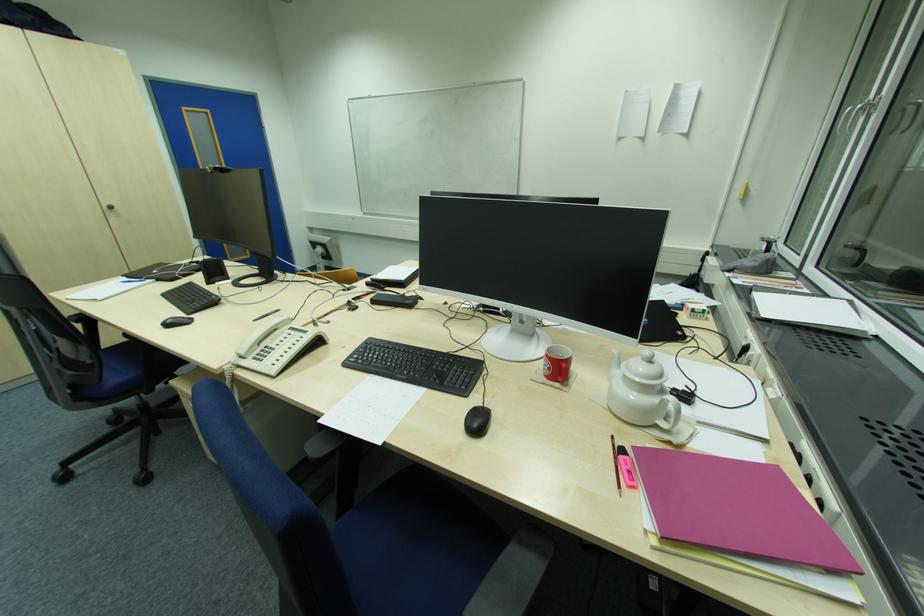
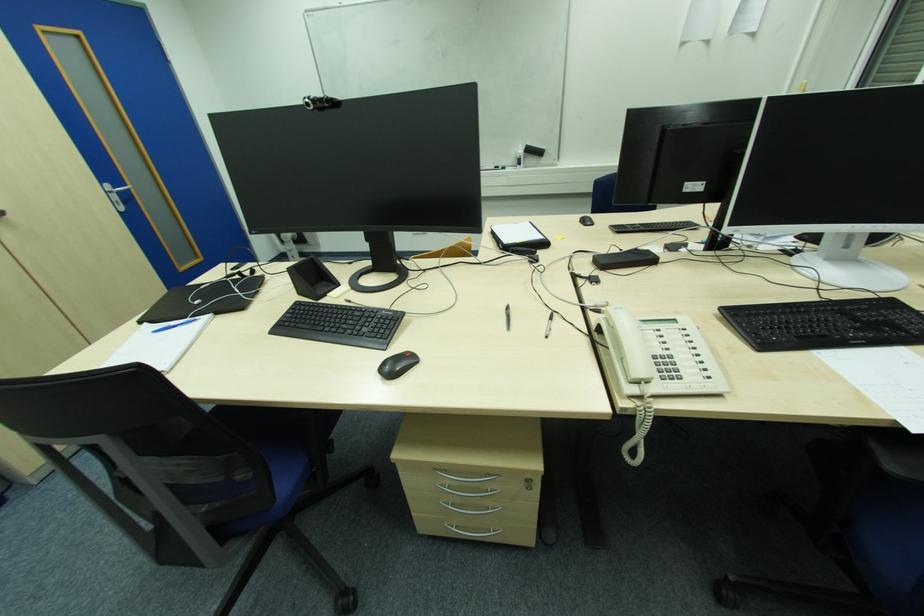
Where in the second image is the point corresponding to point (292, 334) from the first image?

(661, 331)